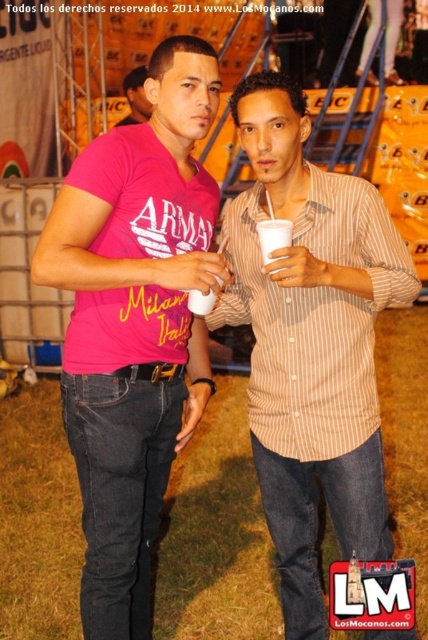
Between point (95, 636) and point (270, 225), which one is positioned in front?

Point (270, 225) is in front.

This screenshot has width=428, height=640. In order to click on matte pink t-shirt at center in this screenshot , I will do `click(134, 323)`.

Is point (344, 195) positioned behind point (133, 124)?

No, it is not.

Who is higher up, brown striped shirt at center or pink fabric shirt at center?

pink fabric shirt at center

Describe the element at coordinates (311, 342) in the screenshot. I see `brown striped shirt at center` at that location.

Identify the location of brown striped shirt at center. (311, 342).

Is point (255, 307) positioned behind point (275, 228)?

That is True.

Does brown striped shirt at center have a greater height compared to white plastic cup at center?

Correct, brown striped shirt at center is much taller as white plastic cup at center.

Who is more distant from viewer, (380, 525) or (276, 221)?

Point (380, 525)

The image size is (428, 640). Identify the location of brown striped shirt at center. (311, 342).